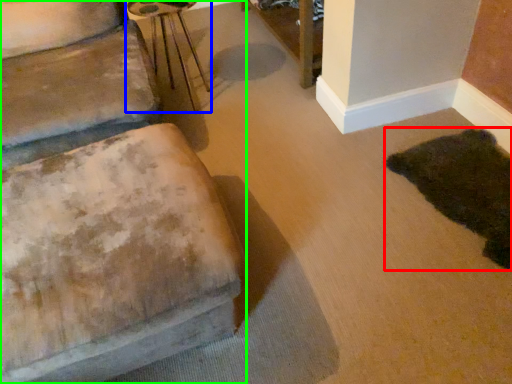
Question: Considering the real-world distances, which object is closest to animal (highlighted by a red box)? side table (highlighted by a blue box) or furniture (highlighted by a green box).

Choices:
 (A) side table
 (B) furniture

Answer: (B)